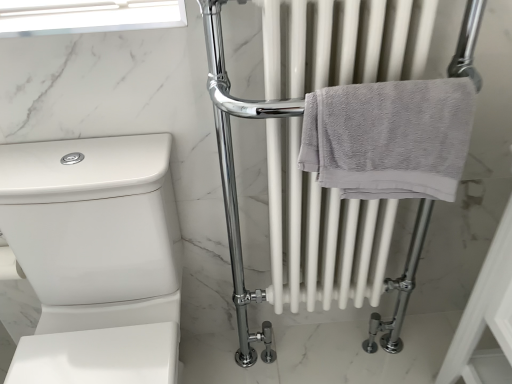
Question: Should I look upward or downward to see white glossy toilet at lower left?

Choices:
 (A) down
 (B) up

Answer: (A)

Question: Is white glossy toilet at lower left behind gray cotton towel at center right?

Choices:
 (A) no
 (B) yes

Answer: (A)

Question: Is white glossy toilet at lower left oriented towards gray cotton towel at center right?

Choices:
 (A) no
 (B) yes

Answer: (A)

Question: Does white glossy toilet at lower left appear on the right side of gray cotton towel at center right?

Choices:
 (A) no
 (B) yes

Answer: (A)

Question: Considering the relative positions of white glossy toilet at lower left and gray cotton towel at center right in the image provided, is white glossy toilet at lower left to the left of gray cotton towel at center right from the viewer's perspective?

Choices:
 (A) no
 (B) yes

Answer: (B)

Question: Considering the relative sizes of white glossy toilet at lower left and gray cotton towel at center right in the image provided, is white glossy toilet at lower left taller than gray cotton towel at center right?

Choices:
 (A) yes
 (B) no

Answer: (A)

Question: Is white glossy toilet at lower left positioned in front of gray cotton towel at center right?

Choices:
 (A) no
 (B) yes

Answer: (B)

Question: Is gray cotton towel at center right not near transparent glass window screen at upper left?

Choices:
 (A) yes
 (B) no

Answer: (B)

Question: Does gray cotton towel at center right appear on the right side of transparent glass window screen at upper left?

Choices:
 (A) no
 (B) yes

Answer: (B)

Question: From the image's perspective, is gray cotton towel at center right located above transparent glass window screen at upper left?

Choices:
 (A) yes
 (B) no

Answer: (B)

Question: Does gray cotton towel at center right have a lesser width compared to transparent glass window screen at upper left?

Choices:
 (A) yes
 (B) no

Answer: (A)

Question: Is gray cotton towel at center right at the left side of transparent glass window screen at upper left?

Choices:
 (A) yes
 (B) no

Answer: (B)

Question: Is gray cotton towel at center right further to camera compared to transparent glass window screen at upper left?

Choices:
 (A) yes
 (B) no

Answer: (B)

Question: From the image's perspective, does transparent glass window screen at upper left appear higher than white glossy toilet at lower left?

Choices:
 (A) no
 (B) yes

Answer: (B)